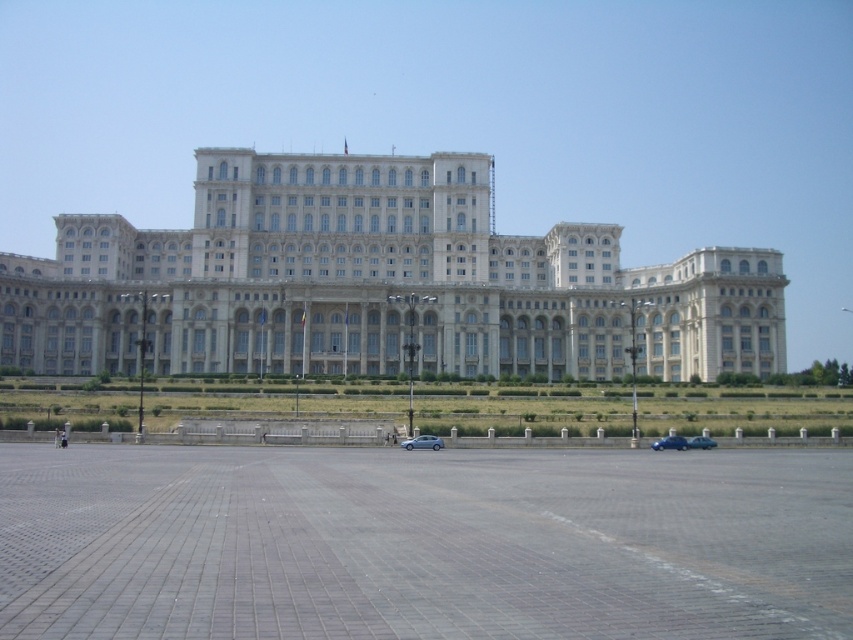
You are standing at the center of the plaza in front of the grand building. You want to park your blue metallic car at lower right in a spot that is closest to the building. Where should you drive to park it?

To park the blue metallic car at lower right closest to the building, you should drive towards the point at the base of the building near the plaza entrance, as that location is nearest to the structure.

You are standing at the edge of the plaza facing the white stone building at center and the teal glossy car at center. If you turn to your right, which object will be on your left side?

The white stone building at center is to the left of the teal glossy car at center, so when facing the building and car, turning to your right would place the teal glossy car at center on your left and the white stone building at center behind you. Therefore, the teal glossy car at center will be on your left side.

You are driving a teal glossy car at center and want to park it in the plaza in front of the white stone building at center. The parking spot you want is exactly as wide as the car. Can you fit the car into the parking spot without touching the building?

The white stone building at center is wider than the teal glossy car at center, so the parking spot in front of it should be wide enough to accommodate the car without touching the building.